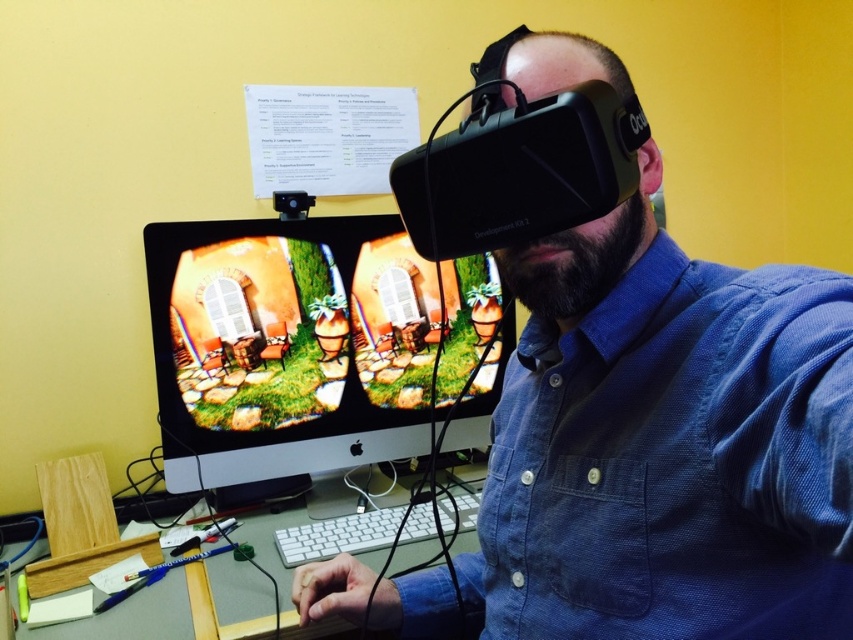
Question: Where is black matte vr headset at center located in relation to white plastic keyboard at center in the image?

Choices:
 (A) below
 (B) above

Answer: (B)

Question: Which object is positioned farthest from the matte black monitor at center?

Choices:
 (A) black matte vr headset at center
 (B) wooden at lower center
 (C) white plastic keyboard at center

Answer: (A)

Question: Which object is positioned closest to the wooden at lower center?

Choices:
 (A) black matte vr headset at center
 (B) matte black monitor at center

Answer: (B)

Question: Is black matte vr headset at center further to camera compared to matte black monitor at center?

Choices:
 (A) no
 (B) yes

Answer: (A)

Question: Which point is closer to the camera?

Choices:
 (A) white plastic keyboard at center
 (B) matte black monitor at center
 (C) wooden at lower center

Answer: (A)

Question: Is black matte vr headset at center below matte black monitor at center?

Choices:
 (A) no
 (B) yes

Answer: (B)